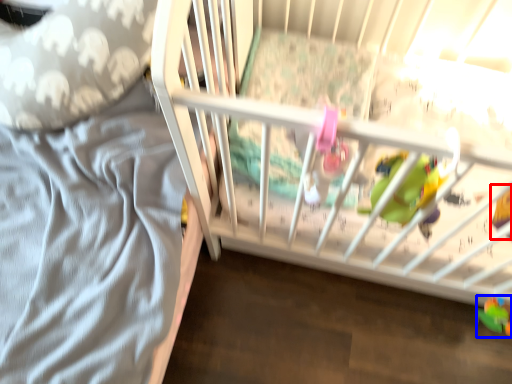
Question: Which object is further to the camera taking this photo, toy (highlighted by a red box) or toy (highlighted by a blue box)?

Choices:
 (A) toy
 (B) toy

Answer: (B)